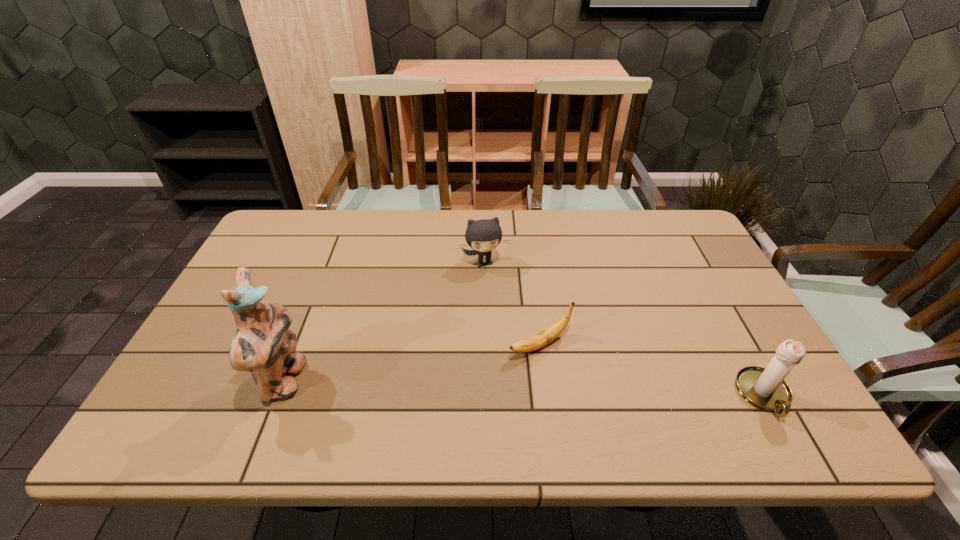
Locate an element on the screen. The width and height of the screenshot is (960, 540). the leftmost object is located at coordinates (263, 345).

Locate an element on the screen. The width and height of the screenshot is (960, 540). the tallest object is located at coordinates (263, 345).

What are the coordinates of `the rightmost object` in the screenshot? It's located at (766, 389).

Identify the location of banana. Image resolution: width=960 pixels, height=540 pixels. (537, 341).

Find the location of a particular element. Image resolution: width=960 pixels, height=540 pixels. the farthest object is located at coordinates (484, 235).

What are the coordinates of `vacant area located on the front-facing side of the leftmost object` in the screenshot? It's located at (374, 382).

At what (x,y) coordinates should I click in order to perform the action: click on vacant position located 0.180m on the peel of the banana from the top. Please return your answer as a coordinate pair (x, y). The image size is (960, 540). Looking at the image, I should click on (449, 387).

At what (x,y) coordinates should I click in order to perform the action: click on free space located 0.260m on the peel of the banana from the top. Please return your answer as a coordinate pair (x, y). Image resolution: width=960 pixels, height=540 pixels. Looking at the image, I should click on (418, 403).

Locate an element on the screen. blank space located 0.210m on the peel of the banana from the top is located at coordinates (438, 393).

Find the location of a particular element. The width and height of the screenshot is (960, 540). free space located 0.210m on the front-facing side of the kitten is located at coordinates (501, 323).